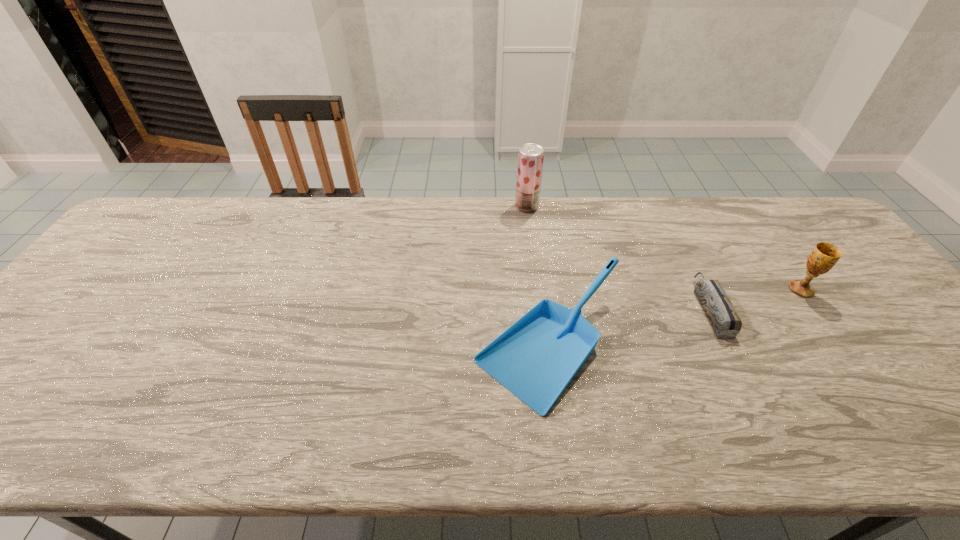
I want to click on free space in the image that satisfies the following two spatial constraints: 1. on the front side of the farthest object; 2. on the right side of the third tallest object, so click(544, 345).

Find the location of a particular element. blank area in the image that satisfies the following two spatial constraints: 1. on the back side of the second shortest object; 2. on the right side of the pencil box is located at coordinates (544, 308).